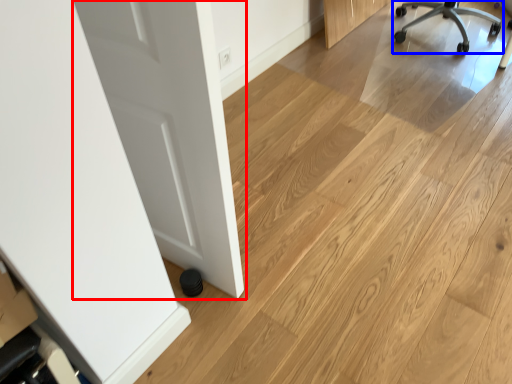
Question: Which object appears closest to the camera in this image, door (highlighted by a red box) or chair (highlighted by a blue box)?

Choices:
 (A) door
 (B) chair

Answer: (A)